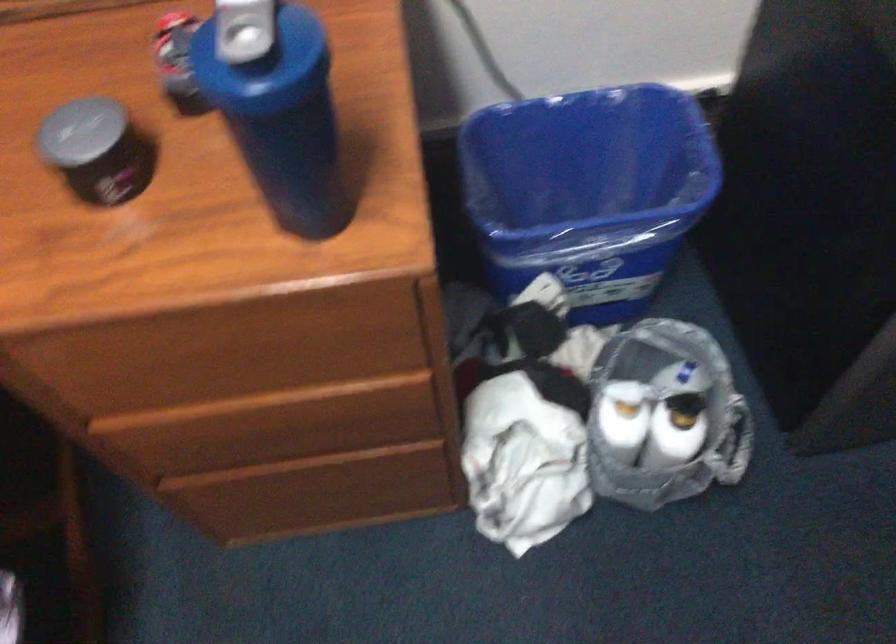
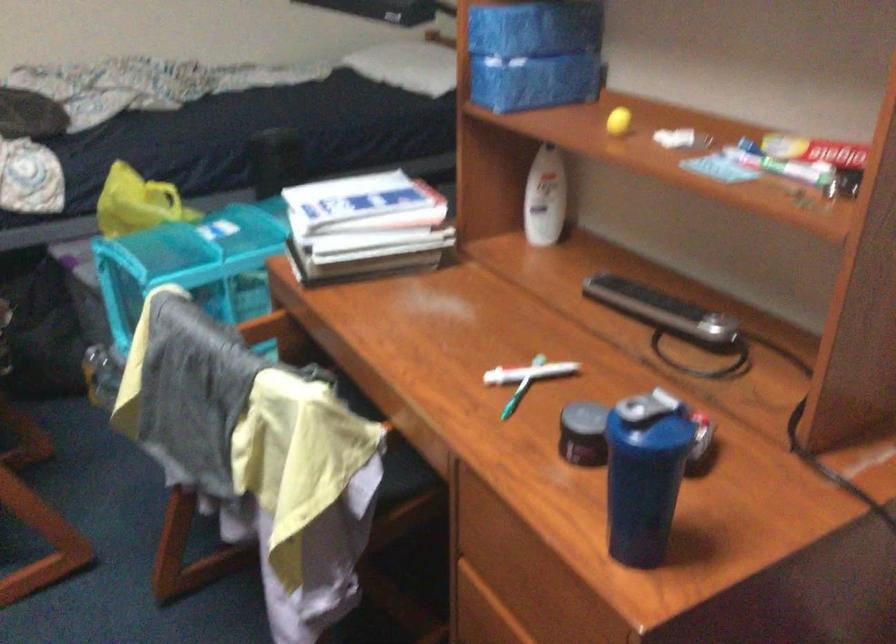
Find the pixel in the second image that matches (x=312, y=120) in the first image.

(644, 474)